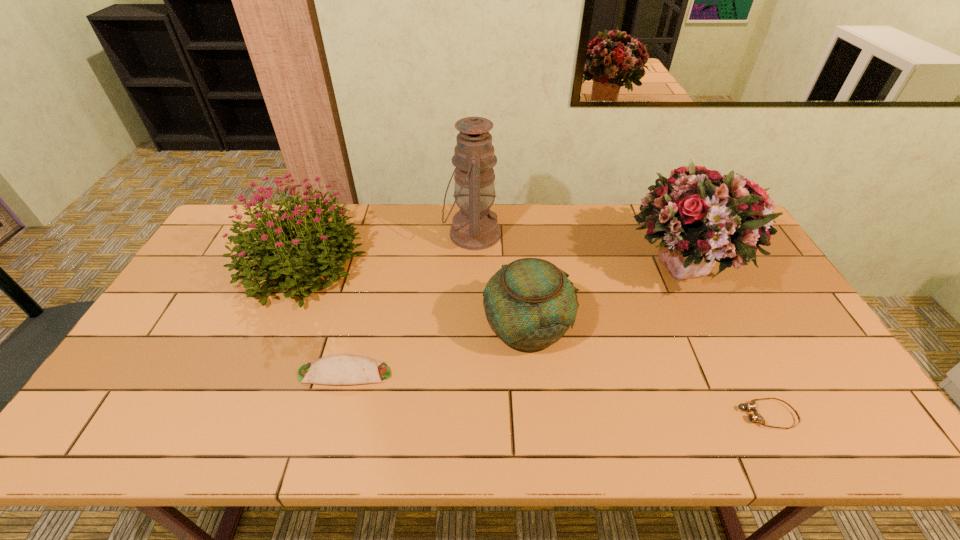
Where is `oil lamp`? Image resolution: width=960 pixels, height=540 pixels. oil lamp is located at coordinates (474, 227).

You are a GUI agent. You are given a task and a screenshot of the screen. Output one action in this format:
    pyautogui.click(x=<x>, y=<y>)
    Task: Click on the right bouquet
    
    Given the screenshot: What is the action you would take?
    pyautogui.click(x=702, y=216)

This screenshot has width=960, height=540. Find the location of `the left bouquet`. the left bouquet is located at coordinates (269, 240).

Find the location of a particular element. the fourth tallest object is located at coordinates (530, 303).

I want to click on the second shortest object, so click(x=340, y=369).

Identify the location of the shortest object. (751, 406).

Image resolution: width=960 pixels, height=540 pixels. Find the location of `the nearest object`. the nearest object is located at coordinates (751, 406).

At what (x,y) coordinates should I click in order to perform the action: click on vacant space located 0.090m on the front of the tallest object. Please return your answer as a coordinate pair (x, y). Looking at the image, I should click on (471, 279).

Image resolution: width=960 pixels, height=540 pixels. Identify the location of vacant space situated 0.290m on the left of the right bouquet. (533, 271).

Where is `free space located on the left of the left bouquet`? The height and width of the screenshot is (540, 960). free space located on the left of the left bouquet is located at coordinates (215, 265).